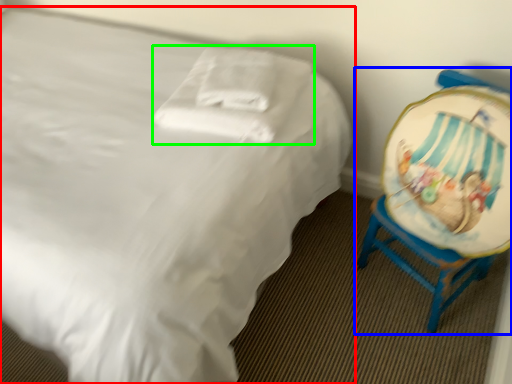
Question: Estimate the real-world distances between objects in this image. Which object is closer to bed (highlighted by a red box), chair (highlighted by a blue box) or pillow (highlighted by a green box)?

Choices:
 (A) chair
 (B) pillow

Answer: (B)